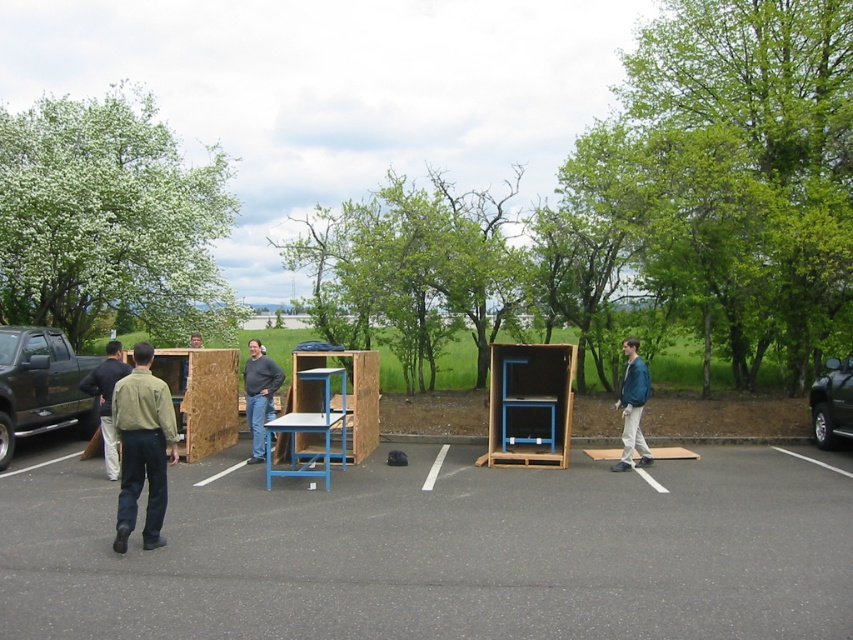
You are standing at the edge of the parking lot and want to walk to the dark gray asphalt at center. According to the coordinates given, in which direction should you move relative to your current position?

The dark gray asphalt at center is located at coordinates point (x=438, y=552). Since you are at the edge of the parking lot, you should move towards the center to reach it.

You are standing in the parking lot and see a blue leather jacket. Where is it located relative to the parking lot? Please provide coordinates in the format of a point within the image frame, such as point (631, 406).

The blue leather jacket at right is located at point (631, 406) in the image frame.